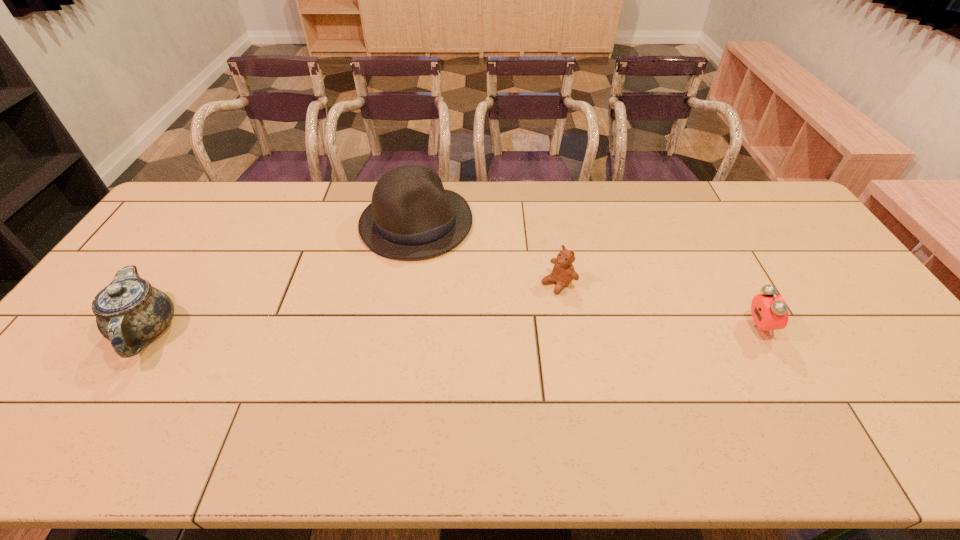
The height and width of the screenshot is (540, 960). I want to click on the second tallest object, so click(x=129, y=311).

Where is `the leftmost object`? This screenshot has height=540, width=960. the leftmost object is located at coordinates (129, 311).

Find the location of a particular element. This screenshot has height=540, width=960. alarm clock is located at coordinates (769, 310).

The width and height of the screenshot is (960, 540). I want to click on bowler hat, so click(x=412, y=216).

The width and height of the screenshot is (960, 540). What are the coordinates of `the farthest object` in the screenshot? It's located at (412, 216).

The width and height of the screenshot is (960, 540). What are the coordinates of `the second object from right to left` in the screenshot? It's located at (563, 272).

What are the coordinates of `free space located 0.220m on the front-facing side of the rightmost object` in the screenshot? It's located at (852, 327).

Find the location of a particular element. free region located 0.370m on the front-facing side of the farthest object is located at coordinates (517, 334).

The height and width of the screenshot is (540, 960). Identify the location of vacant region located 0.220m on the front-facing side of the farthest object. (486, 299).

Locate an element on the screen. The height and width of the screenshot is (540, 960). free space located 0.320m on the front-facing side of the farthest object is located at coordinates (507, 321).